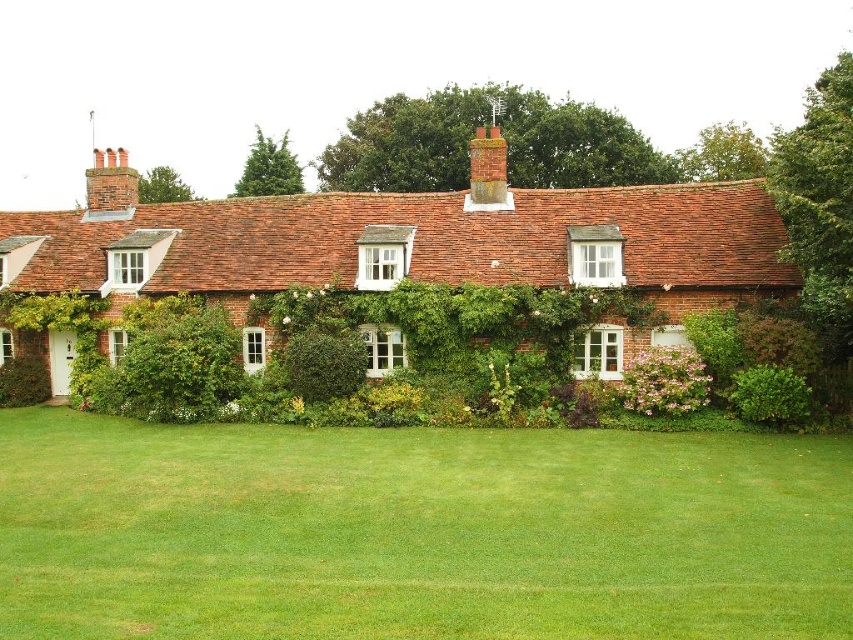
Does green grass at lower center appear on the right side of green leafy hedge at lower right?

No, green grass at lower center is not to the right of green leafy hedge at lower right.

Find the location of a particular element. green grass at lower center is located at coordinates (416, 531).

Locate an element on the screen. green grass at lower center is located at coordinates (416, 531).

Who is positioned more to the left, red brick cottage at center or green leafy hedge at lower right?

red brick cottage at center is more to the left.

Is point (376, 376) positioned in front of point (780, 387)?

No.

In order to click on red brick cottage at center in this screenshot , I will do `click(412, 244)`.

Is red brick cottage at center shorter than green leafy hedge at center?

No, red brick cottage at center is not shorter than green leafy hedge at center.

Where is `red brick cottage at center`? The height and width of the screenshot is (640, 853). red brick cottage at center is located at coordinates (412, 244).